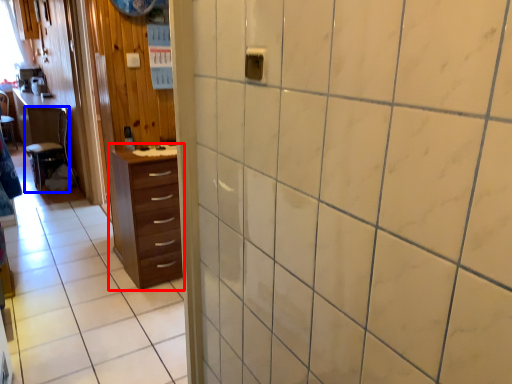
Question: Among these objects, which one is farthest to the camera, chest of drawers (highlighted by a red box) or furniture (highlighted by a blue box)?

Choices:
 (A) chest of drawers
 (B) furniture

Answer: (B)